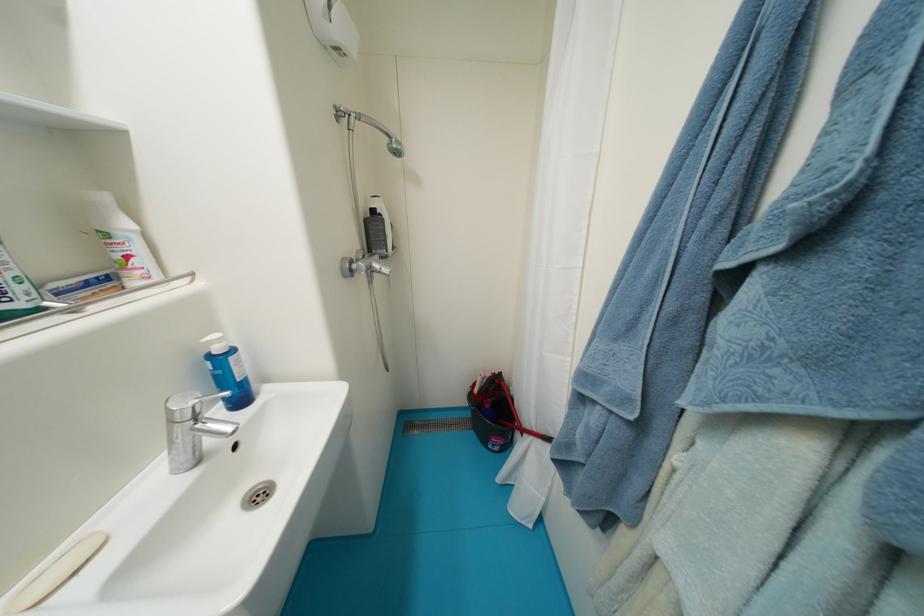
This screenshot has width=924, height=616. I want to click on silver faucet handle, so click(190, 429).